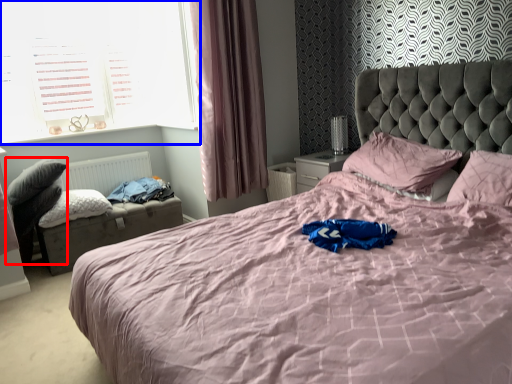
Question: Which of the following is the closest to the observer, swivel chair (highlighted by a red box) or window (highlighted by a blue box)?

Choices:
 (A) swivel chair
 (B) window

Answer: (A)